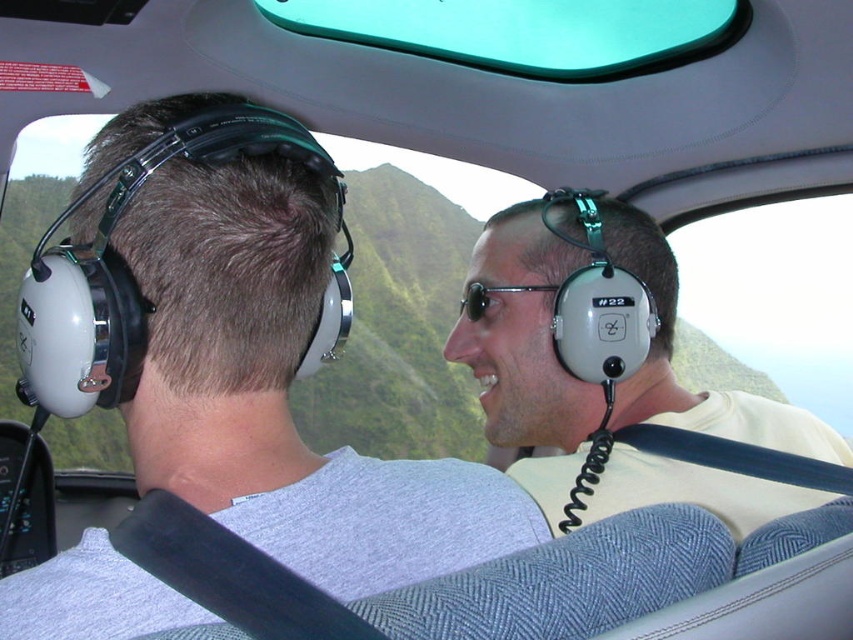
Does gray matte headset at center have a larger size compared to black plastic sunglasses at center?

Yes, gray matte headset at center is bigger than black plastic sunglasses at center.

Where is `gray matte headset at center`? gray matte headset at center is located at coordinates (612, 369).

Between point (560, 262) and point (480, 300), which one is positioned behind?

The point (480, 300) is more distant.

Identify the location of gray matte headset at center. The width and height of the screenshot is (853, 640). (612, 369).